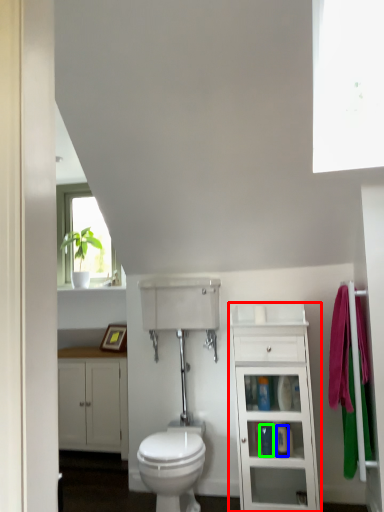
Question: Which object is the closest to the bathroom cabinet (highlighted by a red box)? Choose among these: toiletry (highlighted by a blue box) or toiletry (highlighted by a green box).

Choices:
 (A) toiletry
 (B) toiletry

Answer: (B)